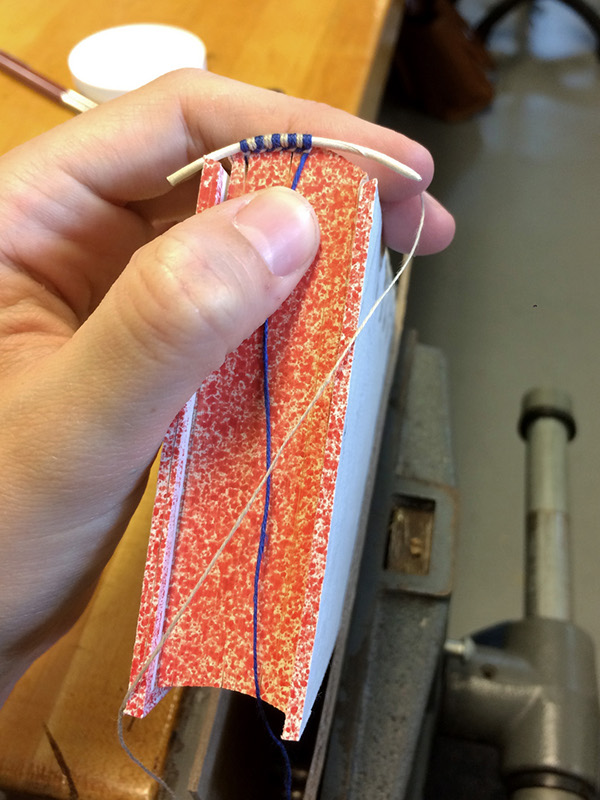
Where is `table`? This screenshot has width=600, height=800. table is located at coordinates (293, 58).